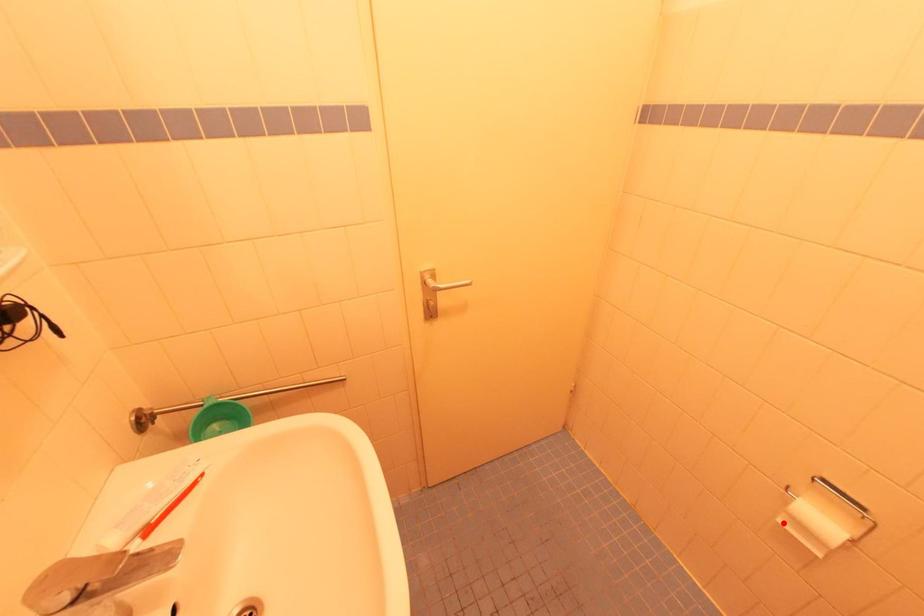
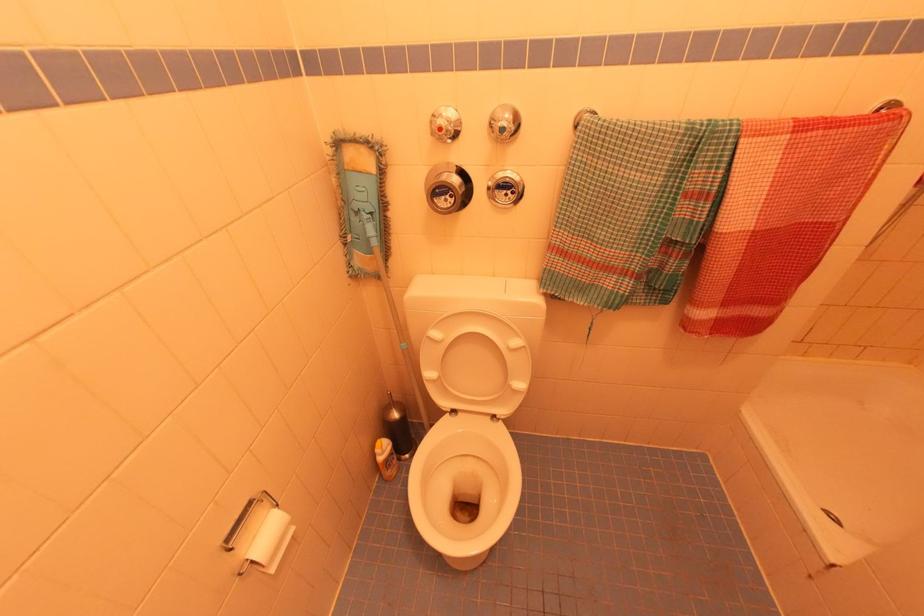
The point at the highlighted location is marked in the first image. Where is the corresponding point in the second image?

(274, 570)